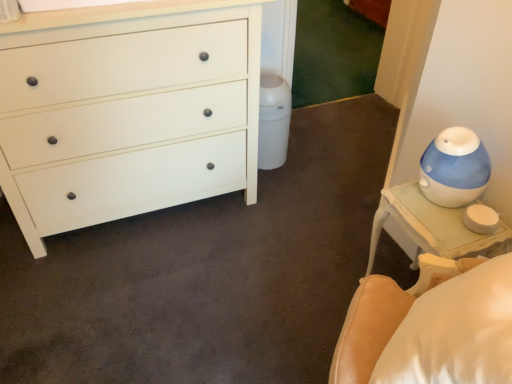
Find the location of a particular element. The height and width of the screenshot is (384, 512). vacant area on the back side of white glossy nightstand at right is located at coordinates (355, 243).